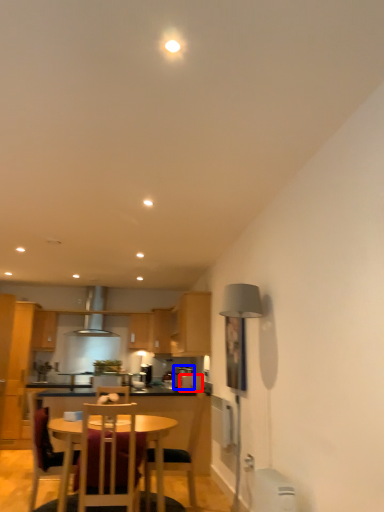
Question: Which object appears closest to the camera in this image, appliance (highlighted by a red box) or appliance (highlighted by a blue box)?

Choices:
 (A) appliance
 (B) appliance

Answer: (A)